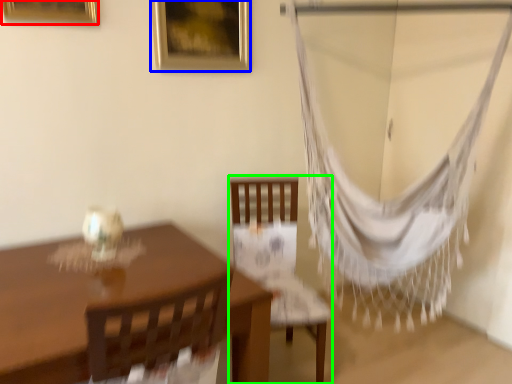
Question: Based on their relative distances, which object is nearer to picture frame (highlighted by a red box)? Choose from picture frame (highlighted by a blue box) and chair (highlighted by a green box).

Choices:
 (A) picture frame
 (B) chair

Answer: (A)